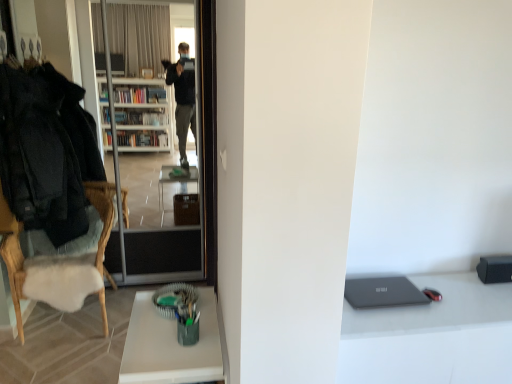
Locate an element on the screen. The height and width of the screenshot is (384, 512). free point above green matte cup at lower center (from a real-world perspective) is located at coordinates (172, 338).